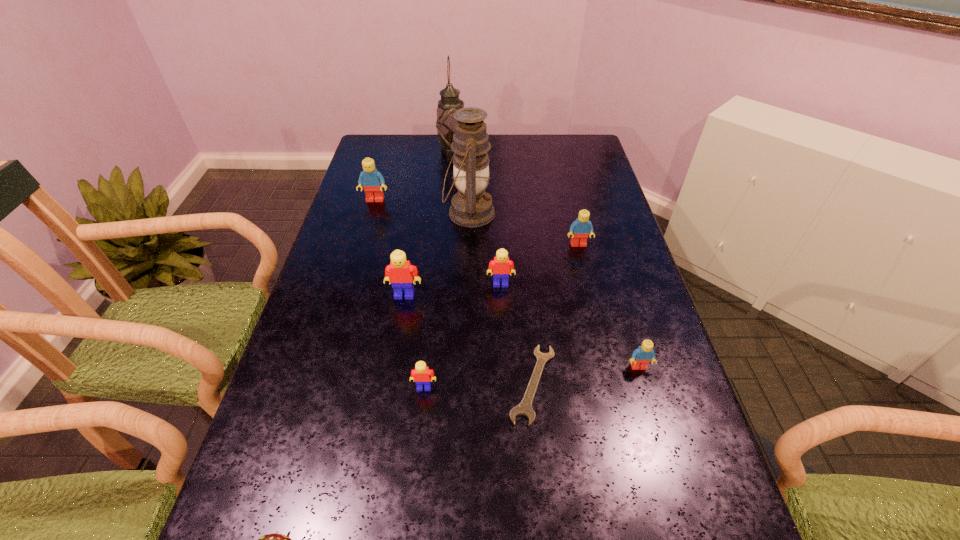
Image resolution: width=960 pixels, height=540 pixels. Identify the location of the farthest object. (450, 102).

You are a GUI agent. You are given a task and a screenshot of the screen. Output one action in this format:
    pyautogui.click(x=<x>, y=<y>)
    Task: Click on the blue oil lamp
    
    Given the screenshot: What is the action you would take?
    pyautogui.click(x=471, y=206)

Locate an element on the screen. the farthest blue Lego is located at coordinates (373, 181).

Where is `the leftmost Lego`? This screenshot has height=540, width=960. the leftmost Lego is located at coordinates (373, 181).

The height and width of the screenshot is (540, 960). Find the location of `the second Lego from left to right`. the second Lego from left to right is located at coordinates (400, 273).

This screenshot has height=540, width=960. I want to click on the leftmost yellow Lego, so click(400, 273).

The image size is (960, 540). I want to click on the seventh nearest object, so click(580, 229).

Locate an element on the screen. the second smallest blue Lego is located at coordinates (580, 229).

Locate an element on the screen. the sixth nearest object is located at coordinates (501, 265).

You are a GUI agent. You are given a task and a screenshot of the screen. Output one action in this format:
    pyautogui.click(x=<x>, y=<y>)
    Task: Click on the fourth nearest Lego
    
    Given the screenshot: What is the action you would take?
    pyautogui.click(x=501, y=265)